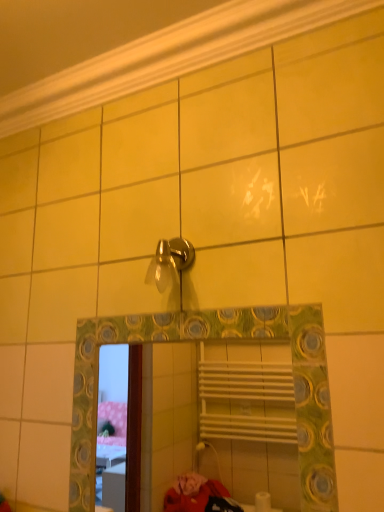
Find the location of a particular element. This screenshot has height=512, width=384. green mosaic mirror at center is located at coordinates tap(220, 420).

Describe the element at coordinates (220, 420) in the screenshot. I see `green mosaic mirror at center` at that location.

I want to click on green mosaic mirror at center, so click(x=220, y=420).